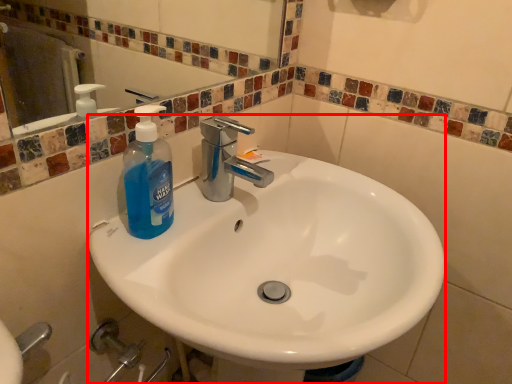
Question: From the image's perspective, what is the correct spatial relationship of sink (annotated by the red box) in relation to bottle?

Choices:
 (A) below
 (B) above

Answer: (A)